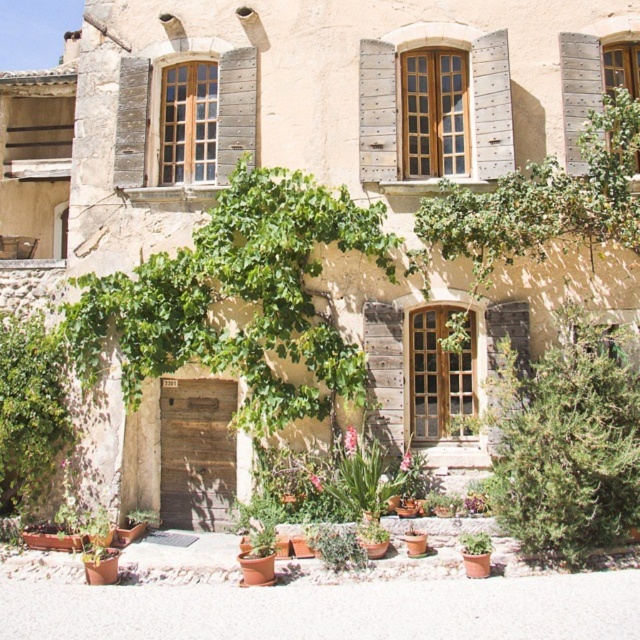
Consider the image. You are standing in front of the rustic building and want to place a small bench. The bench requires 0.5 meters of space. Is there enough space at the location of the green leafy plant at lower left to place the bench?

The green leafy plant at lower left is located at point [29,412]. Since the bench requires 0.5 meters of space, and the coordinates indicate the plant is at that specific point, there should be sufficient space to place the bench there unless there are other obstacles not mentioned in the scene description.

You are a gardener who needs to water two plants in the scene. The green leafy plant at lower left and the green matte plant at lower right. If your watering can holds 10 liters of water and you use 1 liter per meter walked, how many times do you need to refill your watering can to water both plants starting from the entrance?

The distance between the green leafy plant at lower left and green matte plant at lower right is 22.08 feet. First, convert feet to meters by multiplying by 0.3048, resulting in approximately 6.73 meters. Since you start at the entrance, you need to walk to each plant. Assuming you water one plant, return to the entrance, then go to the other, the total distance is 6.73 meters one way, so round trip would be 13.46 meters. However, if you water both in one trip, the distance is 6.73 meters each way, totaling

You are standing in front of the rustic building and want to take a photo. There are two points marked on the building facade at coordinates point (36, 422) and point (364, 566). Which point is closer to your camera when you take the photo?

Point (36, 422) is further to the camera than point (364, 566), so the point closer to the camera is point (364, 566).